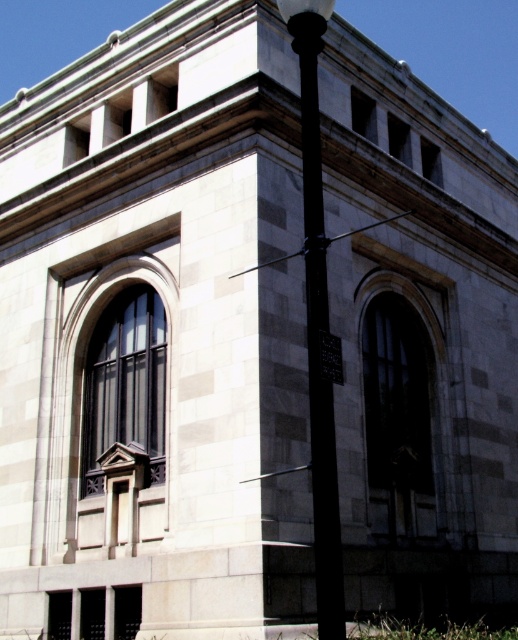
In the scene shown: Which of these two, black metal pole at center or black plastic sign at center, stands taller?

With more height is black metal pole at center.

Can you confirm if black metal pole at center is positioned to the left of black plastic sign at center?

Correct, you'll find black metal pole at center to the left of black plastic sign at center.

Who is more distant from viewer, (305, 179) or (341, 378)?

Positioned behind is point (305, 179).

You are a GUI agent. You are given a task and a screenshot of the screen. Output one action in this format:
    pyautogui.click(x=<x>, y=<y>)
    Task: Click on the black metal pole at center
    
    Given the screenshot: What is the action you would take?
    pyautogui.click(x=318, y=320)